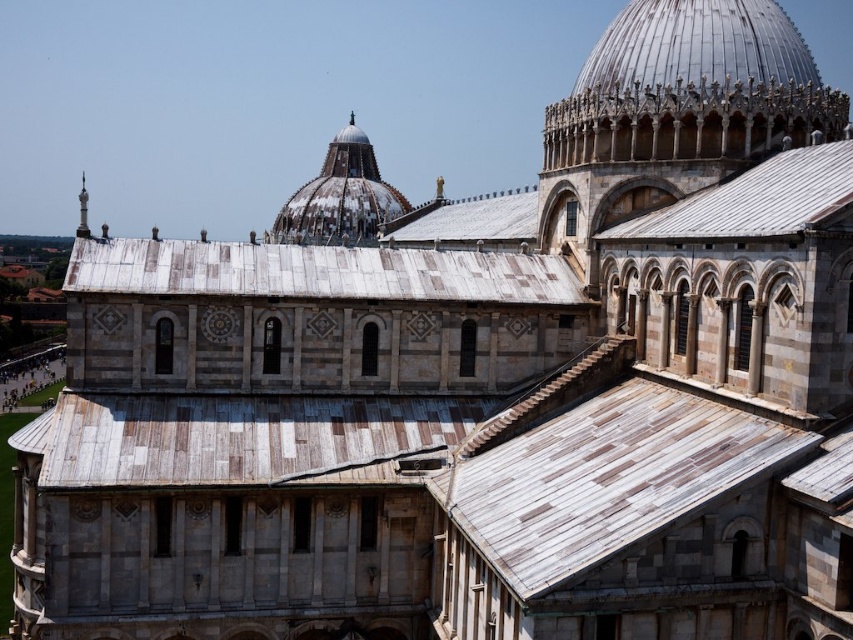
You are an architect analyzing the Piazza dei Miracoli. You observe the white shingles at upper right and the white weathered dome at center. Which of these two elements has a smaller width?

The white shingles at upper right has a lesser width compared to the white weathered dome at center.

You are a tourist standing at the base of the Leaning Tower of Pisa. You notice the weathered wood roof at center and the silver metallic spire at upper left in the distance. If you want to take a photo that includes both objects in the frame, would their distance apart allow for this?

The weathered wood roof at center is 20.37 meters away from the silver metallic spire at upper left. Since both objects are within a reasonable distance from each other, it is possible to capture both in a single photo frame.

You are standing in the Piazza dei Miracoli in Pisa, Italy, looking at the Baptistery and the Leaning Tower of Pisa. You notice two points marked on the ground at point (x=392, y=257) and point (x=90, y=230). Which point is closer to your eyes?

Point (x=392, y=257) is further to the camera than point (x=90, y=230), so the point closer to your eyes is point (x=90, y=230).